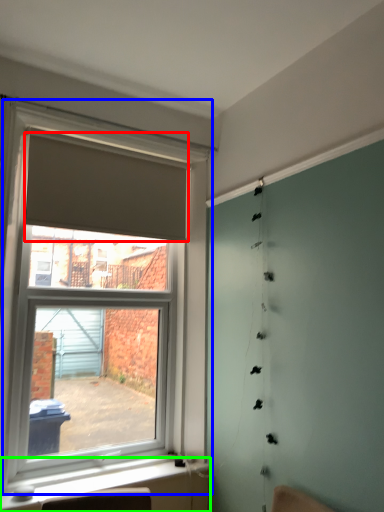
Question: Which object is the closest to the curtain (highlighted by a red box)? Choose among these: window (highlighted by a blue box) or window sill (highlighted by a green box).

Choices:
 (A) window
 (B) window sill

Answer: (A)